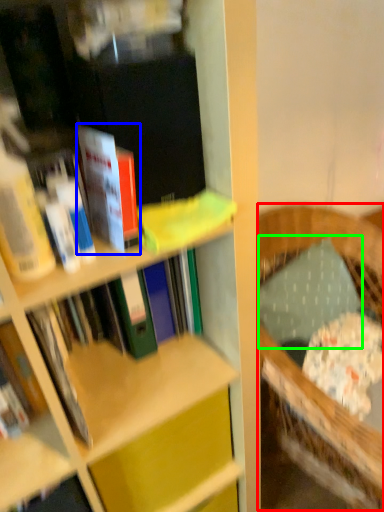
Question: Which object is the closest to the rocking chair (highlighted by a red box)? Choose among these: book (highlighted by a blue box) or pillow (highlighted by a green box).

Choices:
 (A) book
 (B) pillow

Answer: (B)